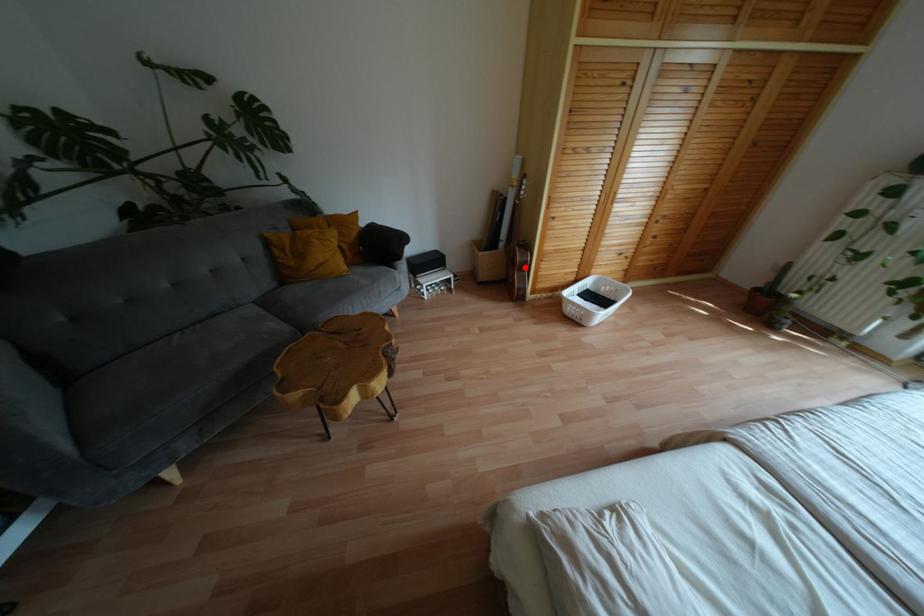
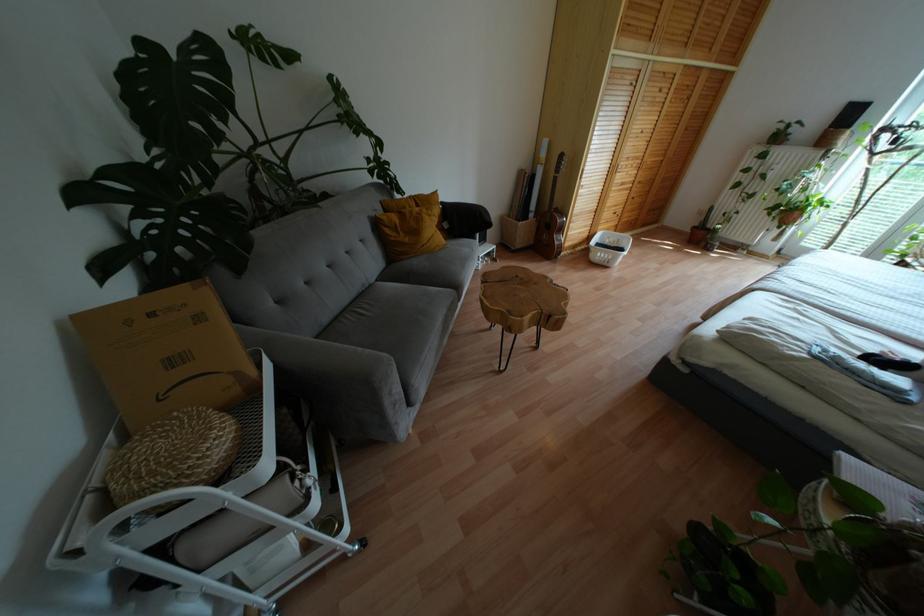
Question: I am providing you with two images of the same scene from different viewpoints. A red point is shown in image1. For the corresponding object point in image2, is it positioned nearer or farther from the camera?

Choices:
 (A) Nearer
 (B) Farther

Answer: (A)